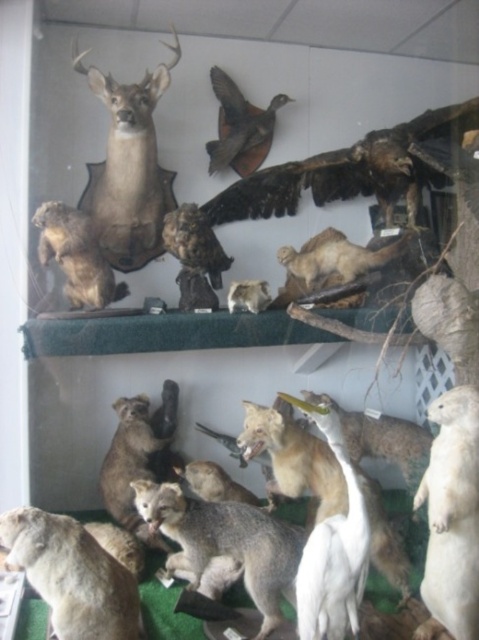
Question: Estimate the real-world distances between objects in this image. Which object is closer to the fuzzy brown fox at lower left?

Choices:
 (A) brown matte bird at upper center
 (B) dark brown feathers at upper center

Answer: (B)

Question: Can you confirm if dark brown feathers at upper center is positioned above matte brown deer at upper left?

Choices:
 (A) no
 (B) yes

Answer: (A)

Question: Which of the following is the farthest from the observer?

Choices:
 (A) (155, 196)
 (B) (227, 148)

Answer: (B)

Question: Does matte brown deer at upper left have a lesser width compared to brown fur owl at upper left?

Choices:
 (A) no
 (B) yes

Answer: (A)

Question: Which point is farther to the camera?

Choices:
 (A) matte brown deer at upper left
 (B) brown fur owl at upper left
 (C) fuzzy brown fox at lower left

Answer: (A)

Question: Can you confirm if dark brown feathers at upper center is smaller than fuzzy brown fox at lower left?

Choices:
 (A) no
 (B) yes

Answer: (A)